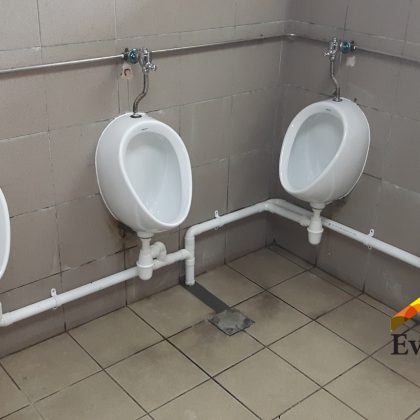
Identify the location of urinals. This screenshot has height=420, width=420. (152, 158), (308, 152), (4, 248).